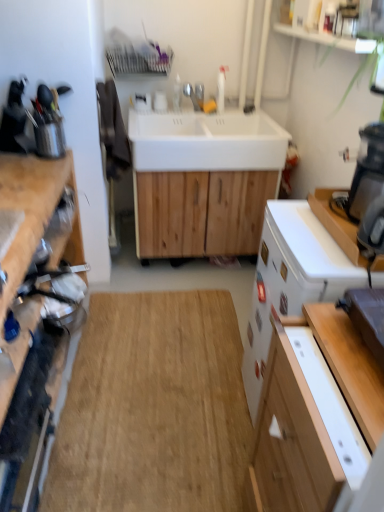
Question: Considering the positions of white glossy sink at center, which appears as the 1th sink when viewed from the top, and white matte sink at center, arranged as the 1th sink when ordered from the bottom, in the image, is white glossy sink at center, which appears as the 1th sink when viewed from the top, bigger or smaller than white matte sink at center, arranged as the 1th sink when ordered from the bottom,?

Choices:
 (A) big
 (B) small

Answer: (B)

Question: Would you say white glossy sink at center, which appears as the 1th sink when viewed from the top, is inside or outside white matte sink at center, which is the second sink in top-to-bottom order?

Choices:
 (A) outside
 (B) inside

Answer: (A)

Question: Estimate the real-world distances between objects in this image. Which object is farther from the wooden cutting board at left, placed as the 1th cabinetry when sorted from left to right?

Choices:
 (A) white glossy sink at center, which appears as the 1th sink when viewed from the top
 (B) white glossy cabinet at lower right, the second cabinetry positioned from the left
 (C) metallic silver knife block at left
 (D) white matte sink at center, which is the second sink in top-to-bottom order
 (E) natural wood table at center

Answer: (A)

Question: Estimate the real-world distances between objects in this image. Which object is farther from the metallic silver knife block at left?

Choices:
 (A) white glossy cabinet at lower right, the second cabinetry positioned from the left
 (B) wooden cutting board at left, placed as the 1th cabinetry when sorted from left to right
 (C) white matte sink at center, arranged as the 1th sink when ordered from the bottom
 (D) natural wood table at center
 (E) white glossy dishwasher at right

Answer: (A)